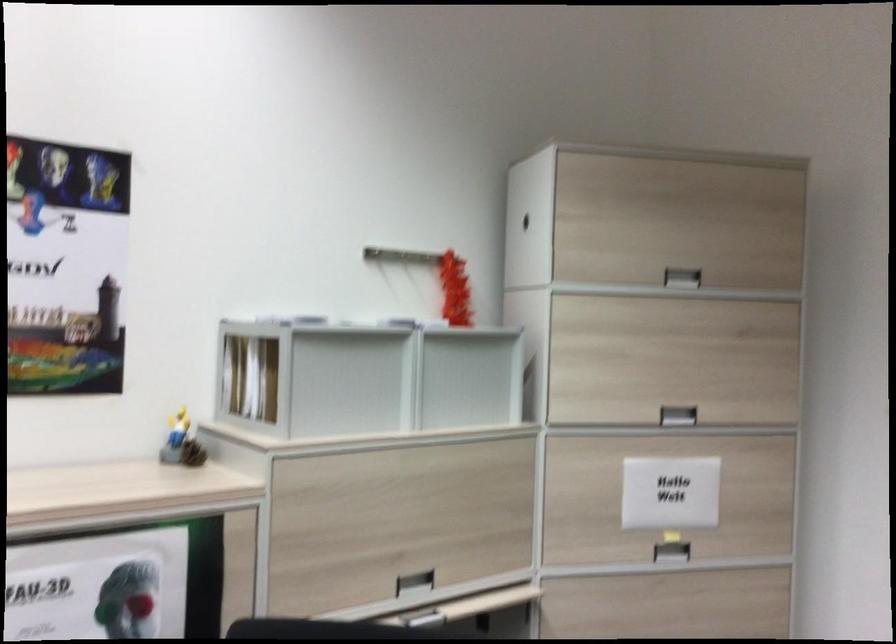
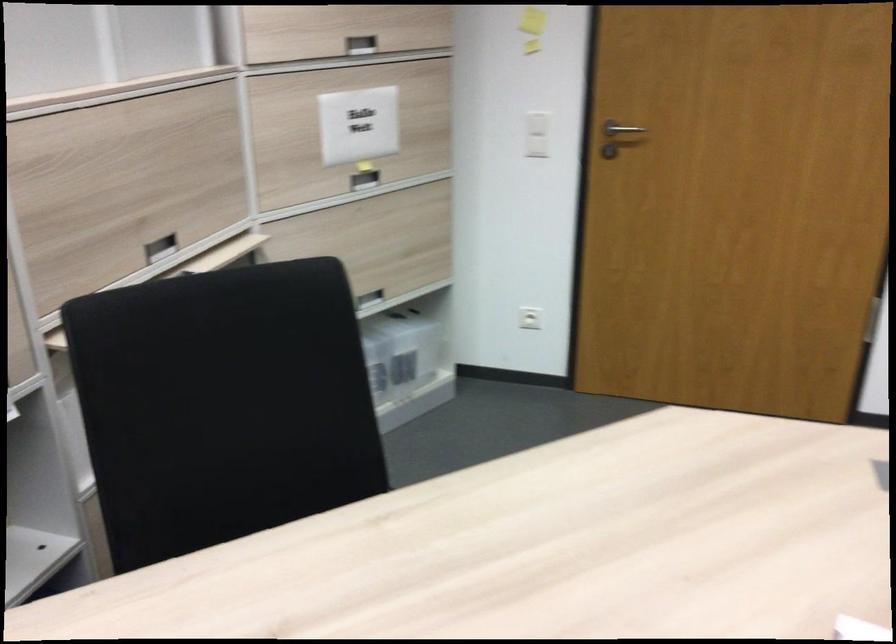
Question: I am providing you with two images of the same scene from different viewpoints. After the viewpoint changes to image2, which objects are now occluded?

Choices:
 (A) white light switch
 (B) recessed cabinet handle
 (C) metal door handle
 (D) none of these

Answer: (D)